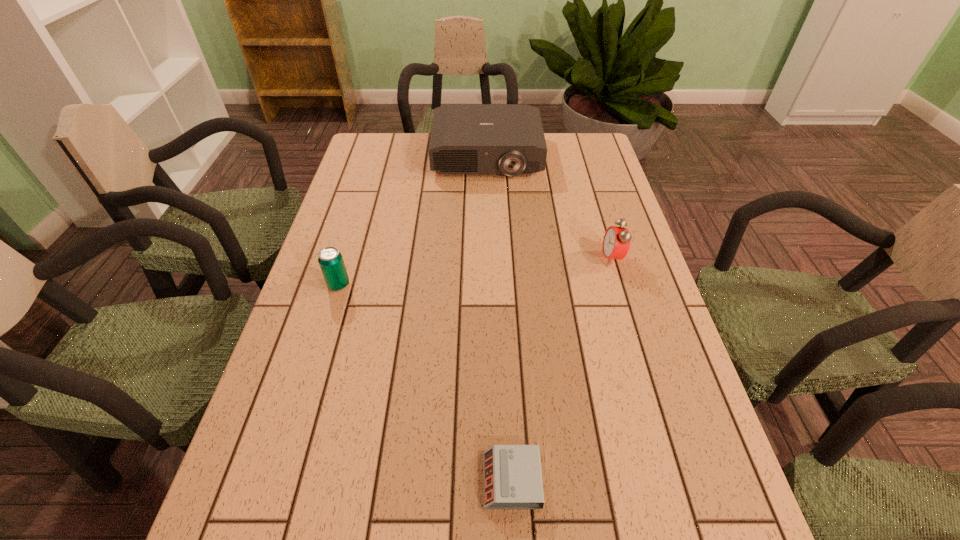
Where is `free spot located 0.390m on the front-facing side of the rightmost object`? This screenshot has height=540, width=960. free spot located 0.390m on the front-facing side of the rightmost object is located at coordinates (454, 259).

Find the location of a particular element. This screenshot has height=540, width=960. free space located 0.120m on the back of the beer can is located at coordinates (350, 245).

Where is `vacant space located on the back of the nearer alarm clock`? vacant space located on the back of the nearer alarm clock is located at coordinates (504, 326).

This screenshot has height=540, width=960. I want to click on object that is at the far edge, so click(508, 139).

Identify the location of object that is at the left edge. (331, 262).

Locate an element on the screen. object that is at the right edge is located at coordinates (616, 243).

You are a GUI agent. You are given a task and a screenshot of the screen. Output one action in this format:
    pyautogui.click(x=<x>, y=<y>)
    Task: Click on the blank space at the right edge of the desktop
    This screenshot has height=540, width=960.
    Given the screenshot: What is the action you would take?
    pyautogui.click(x=696, y=499)

What are the coordinates of `free space at the far left corner of the desktop` in the screenshot? It's located at (399, 136).

Locate an element on the screen. This screenshot has height=540, width=960. free space at the far right corner is located at coordinates (595, 134).

Locate an element on the screen. free space between the shorter alarm clock and the rightmost object is located at coordinates (562, 369).